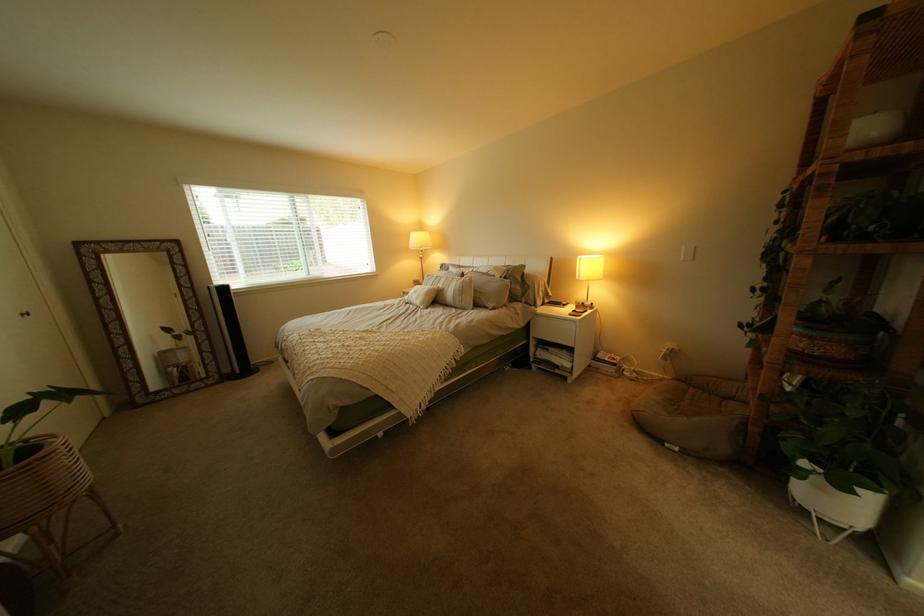
What do you see at coordinates (420, 294) in the screenshot? I see `the small white pillow` at bounding box center [420, 294].